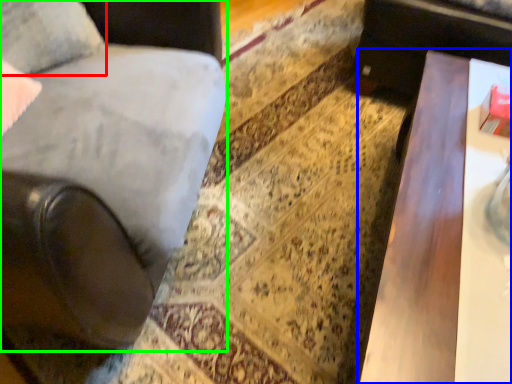
Question: Estimate the real-world distances between objects in this image. Which object is farther from pillow (highlighted by a red box), table (highlighted by a blue box) or chair (highlighted by a green box)?

Choices:
 (A) table
 (B) chair

Answer: (A)